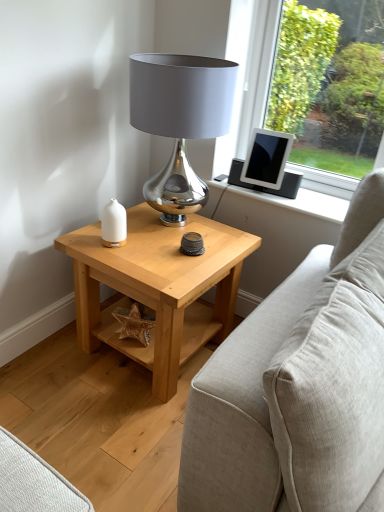
Question: From the image's perspective, is shiny metallic lamp at center beneath light wood/texture side table at center?

Choices:
 (A) yes
 (B) no

Answer: (B)

Question: Is shiny metallic lamp at center facing away from light wood/texture side table at center?

Choices:
 (A) no
 (B) yes

Answer: (A)

Question: From a real-world perspective, is shiny metallic lamp at center located higher than light wood/texture side table at center?

Choices:
 (A) yes
 (B) no

Answer: (A)

Question: Does shiny metallic lamp at center have a lesser height compared to light wood/texture side table at center?

Choices:
 (A) yes
 (B) no

Answer: (B)

Question: Is shiny metallic lamp at center positioned far away from light wood/texture side table at center?

Choices:
 (A) no
 (B) yes

Answer: (A)

Question: In terms of height, does matte black tablet at upper right look taller or shorter compared to light wood/texture side table at center?

Choices:
 (A) short
 (B) tall

Answer: (A)

Question: From a real-world perspective, is matte black tablet at upper right physically located above or below light wood/texture side table at center?

Choices:
 (A) above
 (B) below

Answer: (A)

Question: Is matte black tablet at upper right wider or thinner than light wood/texture side table at center?

Choices:
 (A) wide
 (B) thin

Answer: (B)

Question: Does point (261, 159) appear closer or farther from the camera than point (183, 342)?

Choices:
 (A) closer
 (B) farther

Answer: (B)

Question: Would you say beige fabric couch at right is to the left or to the right of white matte candle holder at left in the picture?

Choices:
 (A) right
 (B) left

Answer: (A)

Question: Is beige fabric couch at right in front of or behind white matte candle holder at left in the image?

Choices:
 (A) behind
 (B) front

Answer: (B)

Question: Looking at their shapes, would you say beige fabric couch at right is wider or thinner than white matte candle holder at left?

Choices:
 (A) wide
 (B) thin

Answer: (A)

Question: From the image's perspective, is beige fabric couch at right above or below white matte candle holder at left?

Choices:
 (A) below
 (B) above

Answer: (A)

Question: Is light wood/texture side table at center wider or thinner than shiny metallic lamp at center?

Choices:
 (A) wide
 (B) thin

Answer: (A)

Question: Looking at the image, does light wood/texture side table at center seem bigger or smaller compared to shiny metallic lamp at center?

Choices:
 (A) big
 (B) small

Answer: (A)